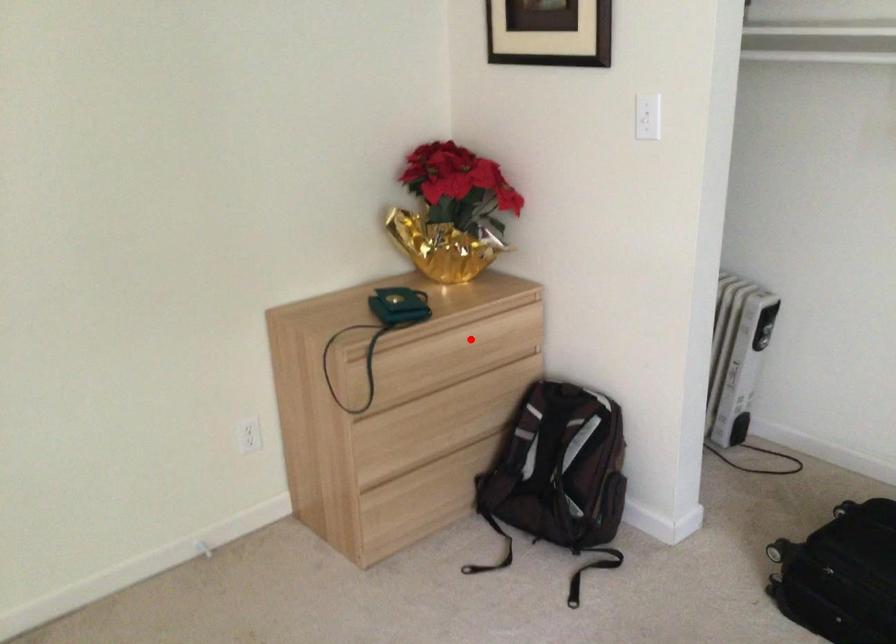
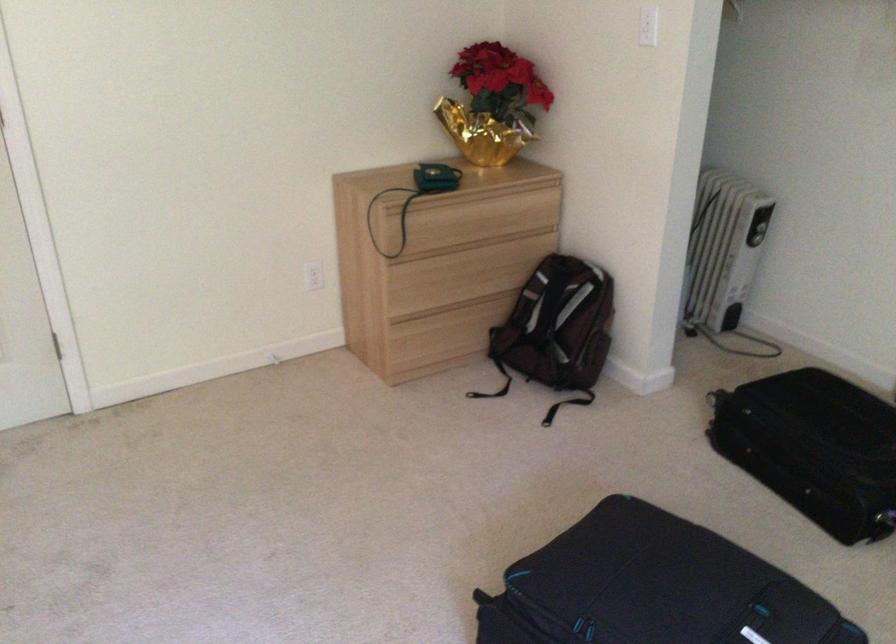
In the second image, find the point that corresponds to the highlighted location in the first image.

(492, 210)